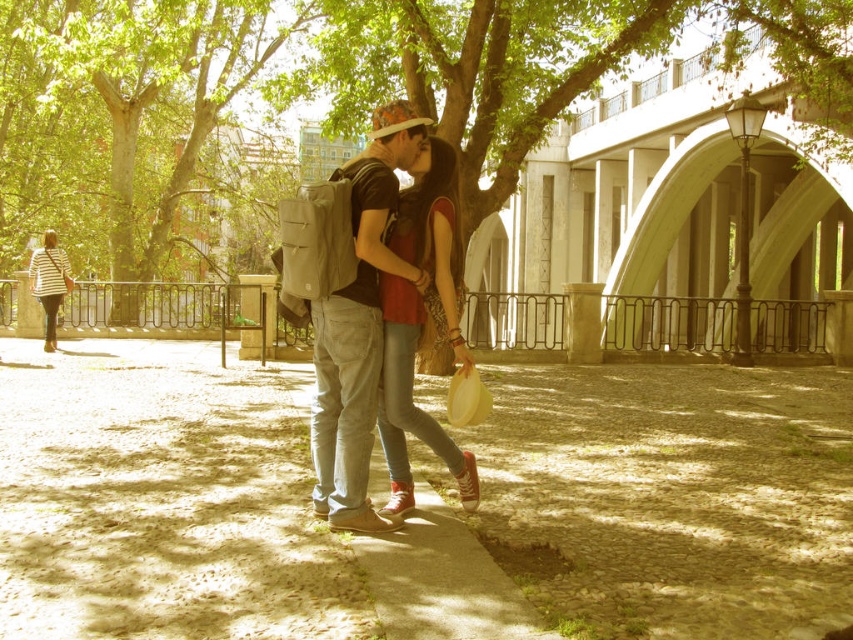
Does matte gray backpack at center appear on the right side of striped fabric bag at left?

Correct, you'll find matte gray backpack at center to the right of striped fabric bag at left.

Between matte gray backpack at center and striped fabric bag at left, which one appears on the left side from the viewer's perspective?

From the viewer's perspective, striped fabric bag at left appears more on the left side.

Measure the distance between point [404,422] and camera.

Point [404,422] and camera are 14.15 feet apart from each other.

What are the coordinates of `matte gray backpack at center` in the screenshot? It's located at (372, 342).

Does green leafy tree at center lie in front of matte red sneakers at center?

No, it is not.

Is point (254, 19) farther from viewer compared to point (460, 240)?

That is True.

Where is `green leafy tree at center`? This screenshot has width=853, height=640. green leafy tree at center is located at coordinates (274, 96).

Can you confirm if green leafy tree at left is positioned to the left of matte gray backpack at center?

Indeed, green leafy tree at left is positioned on the left side of matte gray backpack at center.

Can you confirm if green leafy tree at left is thinner than matte gray backpack at center?

No.

Locate an element on the screen. The width and height of the screenshot is (853, 640). green leafy tree at left is located at coordinates (119, 116).

This screenshot has width=853, height=640. Find the location of `green leafy tree at left`. green leafy tree at left is located at coordinates (119, 116).